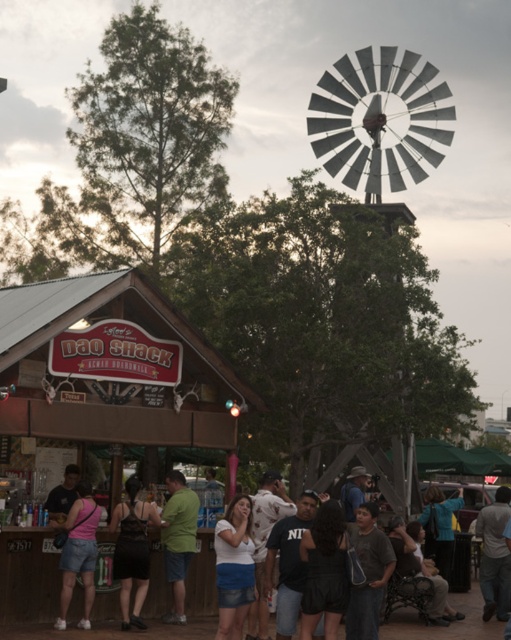
Question: Which point is closer to the camera?

Choices:
 (A) white cotton shirt at center
 (B) gray cotton shirt at lower right
 (C) pink denim shorts at lower left
 (D) green cotton shirt at center

Answer: (A)

Question: Is black mesh tank top at lower left thinner than matte gray shirt at lower center?

Choices:
 (A) yes
 (B) no

Answer: (A)

Question: Which point appears farthest from the camera in this image?

Choices:
 (A) (174, 611)
 (B) (502, 588)
 (C) (86, 490)

Answer: (B)

Question: Is pink denim shorts at lower left smaller than green cotton shirt at center?

Choices:
 (A) yes
 (B) no

Answer: (A)

Question: Can you confirm if green cotton shirt at center is positioned to the right of gray cotton shirt at lower right?

Choices:
 (A) no
 (B) yes

Answer: (A)

Question: Among these objects, which one is nearest to the camera?

Choices:
 (A) green cotton shirt at center
 (B) gray cotton shirt at lower right
 (C) black mesh tank top at lower left

Answer: (C)